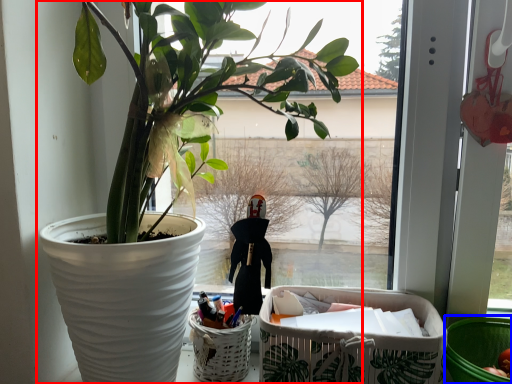
Question: Which object appears closest to the camera in this image, houseplant (highlighted by a red box) or basket container (highlighted by a blue box)?

Choices:
 (A) houseplant
 (B) basket container

Answer: (A)